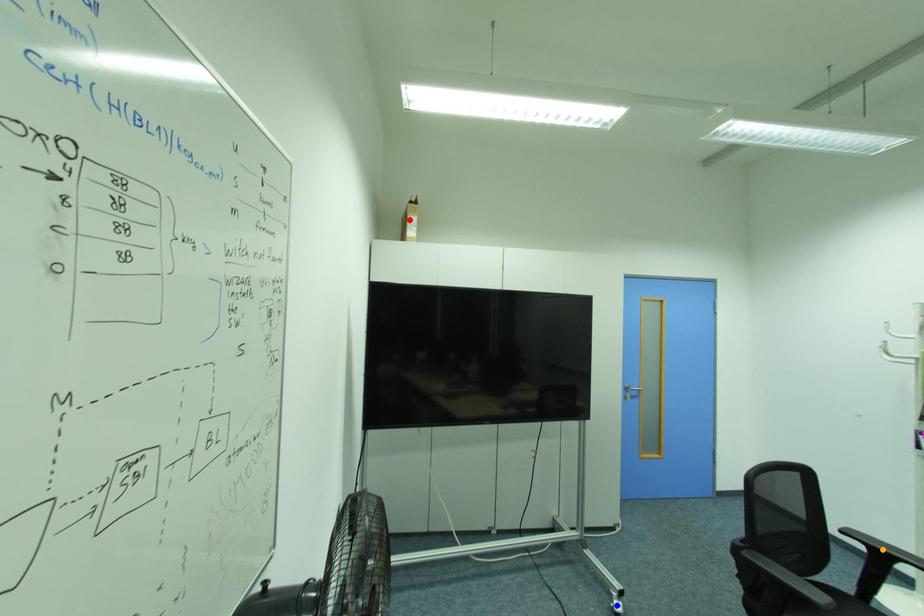
Order these from nearest to farthest:
A) orange point
B) red point
C) blue point

1. red point
2. blue point
3. orange point